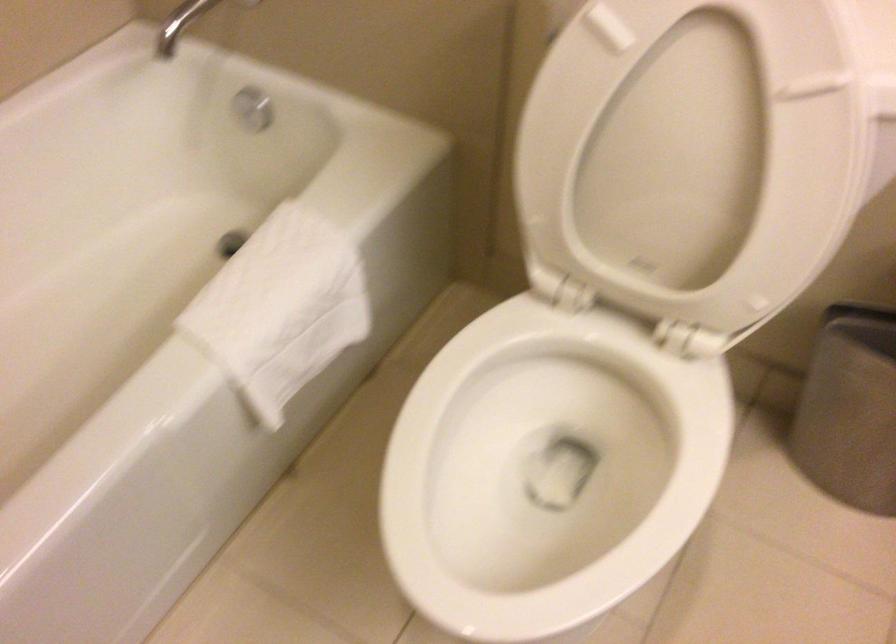
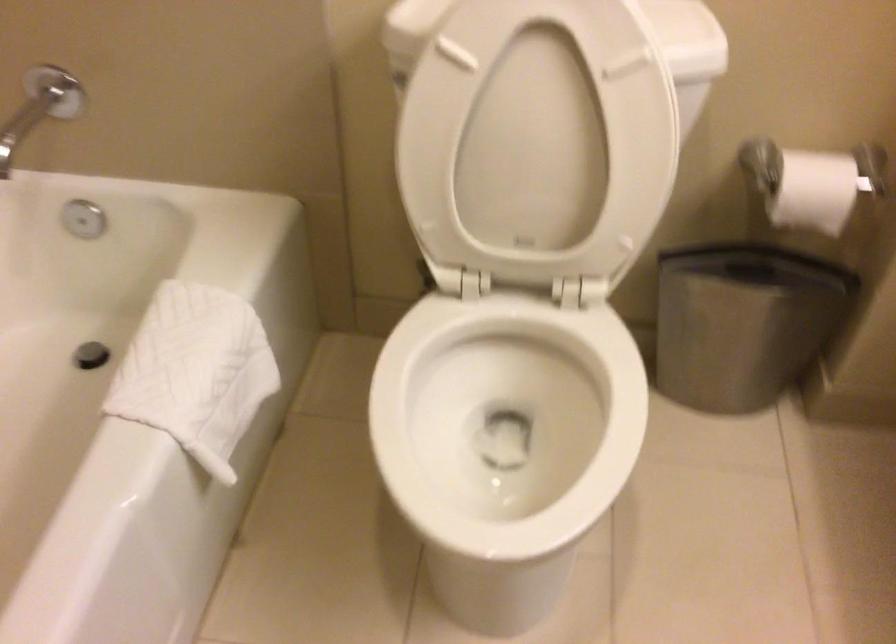
Where in the second image is the point corresponding to point (683, 158) from the first image?

(538, 140)